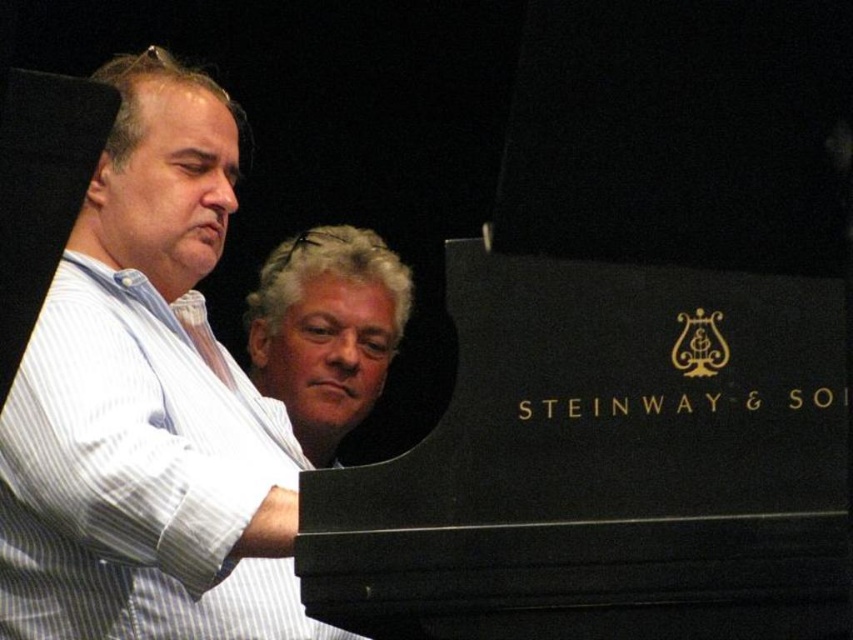
Does white striped shirt at left lie behind gray hair at center?

No, white striped shirt at left is in front of gray hair at center.

Between point (172, 257) and point (357, 348), which one is positioned in front?

Point (172, 257)

Find the location of a particular element. This screenshot has width=853, height=640. white striped shirt at left is located at coordinates (148, 404).

Which is in front, point (517, 259) or point (306, 358)?

Point (517, 259) is in front.

Between point (498, 380) and point (312, 428), which one is positioned behind?

The point (312, 428) is behind.

Consider the image. Who is more distant from viewer, (x=518, y=300) or (x=277, y=252)?

The point (x=277, y=252) is behind.

This screenshot has height=640, width=853. What are the coordinates of `black polished wood piano at center` in the screenshot? It's located at (604, 465).

Can you confirm if black polished wood piano at center is bigger than white striped shirt at left?

Incorrect, black polished wood piano at center is not larger than white striped shirt at left.

Does black polished wood piano at center have a lesser height compared to white striped shirt at left?

Correct, black polished wood piano at center is not as tall as white striped shirt at left.

Does point (779, 545) come behind point (189, 339)?

No, it is not.

In order to click on black polished wood piano at center in this screenshot , I will do `click(604, 465)`.